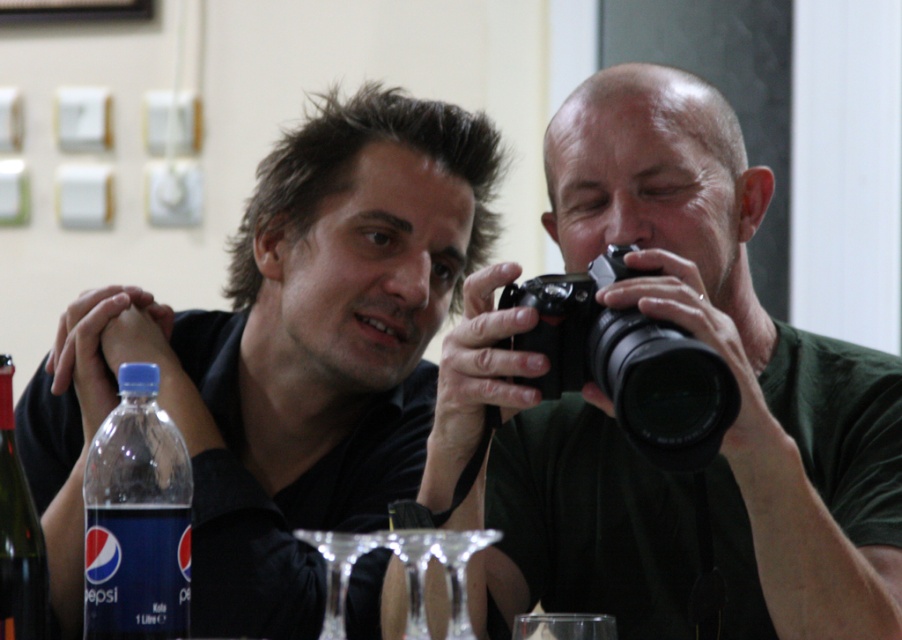
You are setting up a small display on a table and need to place a tall object between the blue plastic bottle at lower left and the translucent glass bottle at lower left. Which bottle should you place the tall object next to?

The blue plastic bottle at lower left is much taller than the translucent glass bottle at lower left, so you should place the tall object next to the blue plastic bottle at lower left since it is already the taller one.

You are organizing a photography exhibition and need to place the black plastic camera at center and the translucent glass bottle at lower left on a shelf. If the shelf has limited space, which item should you place first to ensure both fit?

The translucent glass bottle at lower left is smaller in size than the black plastic camera at center. Place the larger black plastic camera at center first to accommodate its size, then the smaller translucent glass bottle at lower left will fit alongside it.

You are trying to place a small decorative item between the black plastic camera at center and the translucent glass bottle at lower left on the table. Based on their sizes, will there be enough space for the item?

The black plastic camera at center might be wider than translucent glass bottle at lower left, so there may not be enough space between them for the decorative item.